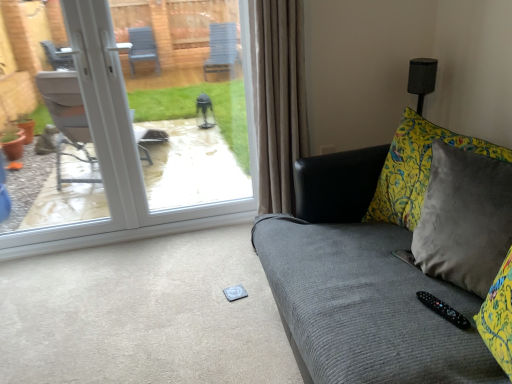
Question: Is black plastic remote at lower right inside or outside of white plastic door at upper left?

Choices:
 (A) outside
 (B) inside

Answer: (A)

Question: Is black plastic remote at lower right in front of or behind white plastic door at upper left in the image?

Choices:
 (A) behind
 (B) front

Answer: (B)

Question: Which of these objects is positioned farthest from the black plastic remote at lower right?

Choices:
 (A) white plastic door at upper left
 (B) velvet gray couch at right

Answer: (A)

Question: Which is farther from the velvet gray couch at right?

Choices:
 (A) white plastic door at upper left
 (B) black plastic remote at lower right

Answer: (A)